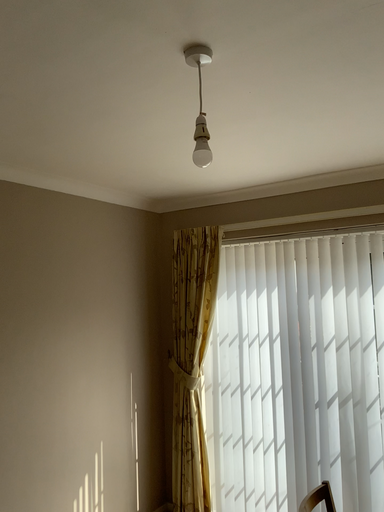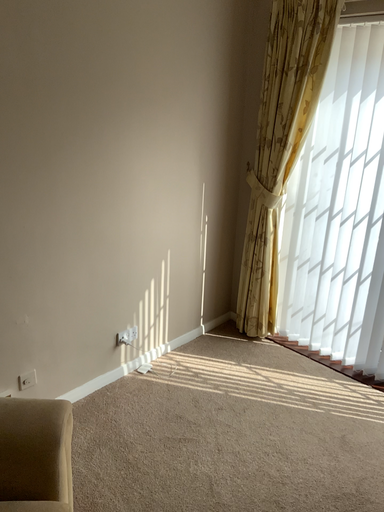
Question: How did the camera likely rotate when shooting the video?

Choices:
 (A) rotated left
 (B) rotated right

Answer: (A)